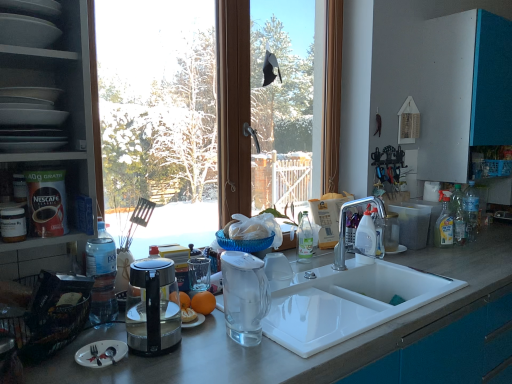
At what (x,y) coordinates should I click in order to perform the action: click on free area behind transparent glass blender at sink. Please return your answer as a coordinate pair (x, y). The image size is (512, 384). Looking at the image, I should click on (271, 311).